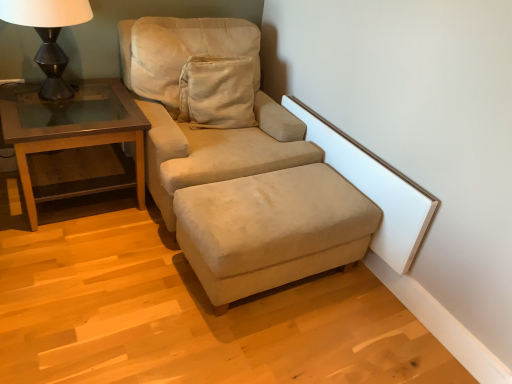
You are a GUI agent. You are given a task and a screenshot of the screen. Output one action in this format:
    pyautogui.click(x=<x>, y=<y>)
    Task: Click on the brown wood/glass table at left
    The height and width of the screenshot is (384, 512).
    Given the screenshot: What is the action you would take?
    pyautogui.click(x=71, y=132)

Identify the location of suede beige studio couch at center. The width and height of the screenshot is (512, 384). (239, 172).

Between point (296, 201) and point (34, 143), which one is positioned in front?

The point (34, 143) is closer to the camera.

Considering the sizes of beige suede ottoman at lower center and brown wood/glass table at left in the image, is beige suede ottoman at lower center bigger or smaller than brown wood/glass table at left?

Considering their sizes, beige suede ottoman at lower center takes up less space than brown wood/glass table at left.

At what (x,y) coordinates should I click in order to perform the action: click on table above the beige suede ottoman at lower center (from a real-world perspective). Please return your answer as a coordinate pair (x, y). The image size is (512, 384). Looking at the image, I should click on (71, 132).

Considering the sizes of beige suede ottoman at lower center and brown wood/glass table at left in the image, is beige suede ottoman at lower center wider or thinner than brown wood/glass table at left?

Considering their sizes, beige suede ottoman at lower center looks slimmer than brown wood/glass table at left.

Is brown wood/glass table at left spatially inside beige suede ottoman at lower center, or outside of it?

brown wood/glass table at left is spatially situated outside beige suede ottoman at lower center.

Is brown wood/glass table at left bigger or smaller than beige suede ottoman at lower center?

Clearly, brown wood/glass table at left is larger in size than beige suede ottoman at lower center.

Consider the image. Does brown wood/glass table at left have a lesser width compared to beige suede ottoman at lower center?

In fact, brown wood/glass table at left might be wider than beige suede ottoman at lower center.

Is point (38, 190) positioned behind point (282, 178)?

Yes, it is behind point (282, 178).

How distant is beige suede ottoman at lower center from matte black lamp at left?

beige suede ottoman at lower center and matte black lamp at left are 1.15 meters apart from each other.

Considering the positions of objects beige suede ottoman at lower center and matte black lamp at left in the image provided, who is more to the left, beige suede ottoman at lower center or matte black lamp at left?

From the viewer's perspective, matte black lamp at left appears more on the left side.

From the image's perspective, is beige suede ottoman at lower center under matte black lamp at left?

Yes.

From a real-world perspective, which is physically below, beige suede ottoman at lower center or matte black lamp at left?

From a 3D spatial view, beige suede ottoman at lower center is below.

Is matte black lamp at left further to camera compared to beige suede ottoman at lower center?

Yes, matte black lamp at left is behind beige suede ottoman at lower center.

Can you confirm if matte black lamp at left is wider than beige suede ottoman at lower center?

Incorrect, the width of matte black lamp at left does not surpass that of beige suede ottoman at lower center.

Between point (62, 88) and point (293, 183), which one is positioned in front?

The point (293, 183) is closer.

Looking at their sizes, would you say brown wood/glass table at left is wider or thinner than suede beige studio couch at center?

In the image, brown wood/glass table at left appears to be more narrow than suede beige studio couch at center.

Between brown wood/glass table at left and suede beige studio couch at center, which one has less height?

brown wood/glass table at left is shorter.

Is suede beige studio couch at center surrounded by brown wood/glass table at left?

Definitely not — suede beige studio couch at center is not inside brown wood/glass table at left.

Who is bigger, matte black lamp at left or brown wood/glass table at left?

brown wood/glass table at left.

At what (x,y) coordinates should I click in order to perform the action: click on table lamp that is above the brown wood/glass table at left (from a real-world perspective). Please return your answer as a coordinate pair (x, y). This screenshot has height=384, width=512. Looking at the image, I should click on (48, 36).

Is matte black lamp at left not near brown wood/glass table at left?

matte black lamp at left is actually quite close to brown wood/glass table at left.

Which of these two, matte black lamp at left or brown wood/glass table at left, is wider?

brown wood/glass table at left.

From a real-world perspective, is matte black lamp at left under suede beige studio couch at center?

No, from a real-world perspective, matte black lamp at left is not beneath suede beige studio couch at center.

From the image's perspective, is matte black lamp at left on suede beige studio couch at center?

Correct, matte black lamp at left appears higher than suede beige studio couch at center in the image.

The image size is (512, 384). Find the location of `footrest below the brown wood/glass table at left (from the image's perspective)`. footrest below the brown wood/glass table at left (from the image's perspective) is located at coordinates (271, 229).

Locate an element on the screen. Image resolution: width=512 pixels, height=384 pixels. table on the left side of beige suede ottoman at lower center is located at coordinates coord(71,132).

Based on their spatial positions, is brown wood/glass table at left or suede beige studio couch at center closer to matte black lamp at left?

brown wood/glass table at left is positioned closer to the anchor matte black lamp at left.

Which object lies further to the anchor point brown wood/glass table at left, matte black lamp at left or suede beige studio couch at center?

Among the two, suede beige studio couch at center is located further to brown wood/glass table at left.

When comparing their distances from beige suede ottoman at lower center, does suede beige studio couch at center or matte black lamp at left seem closer?

suede beige studio couch at center is positioned closer to the anchor beige suede ottoman at lower center.

Consider the image. Based on their spatial positions, is suede beige studio couch at center or beige suede ottoman at lower center further from matte black lamp at left?

beige suede ottoman at lower center is positioned further to the anchor matte black lamp at left.

Considering their positions, is suede beige studio couch at center positioned closer to brown wood/glass table at left than matte black lamp at left?

Based on the image, matte black lamp at left appears to be nearer to brown wood/glass table at left.

Which object lies nearer to the anchor point suede beige studio couch at center, brown wood/glass table at left or matte black lamp at left?

Based on the image, brown wood/glass table at left appears to be nearer to suede beige studio couch at center.

Based on their spatial positions, is beige suede ottoman at lower center or suede beige studio couch at center closer to matte black lamp at left?

Based on the image, suede beige studio couch at center appears to be nearer to matte black lamp at left.

When comparing their distances from matte black lamp at left, does suede beige studio couch at center or brown wood/glass table at left seem further?

suede beige studio couch at center lies further to matte black lamp at left than the other object.

In order to click on table located between matte black lamp at left and beige suede ottoman at lower center in the left-right direction in this screenshot , I will do `click(71, 132)`.

This screenshot has height=384, width=512. In order to click on studio couch situated between matte black lamp at left and beige suede ottoman at lower center from left to right in this screenshot , I will do `click(239, 172)`.

Locate an element on the screen. This screenshot has height=384, width=512. table between matte black lamp at left and suede beige studio couch at center is located at coordinates (71, 132).

Where is `studio couch located between brown wood/glass table at left and beige suede ottoman at lower center in the left-right direction`? studio couch located between brown wood/glass table at left and beige suede ottoman at lower center in the left-right direction is located at coordinates (239, 172).